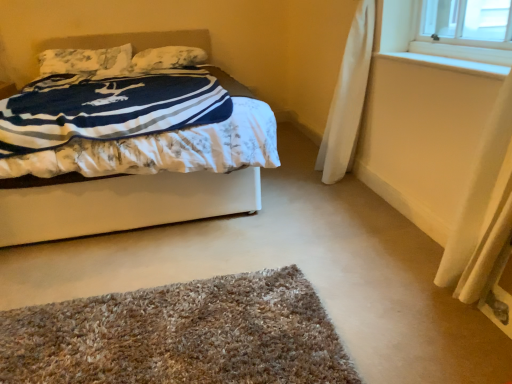
Question: Does brown shaggy rug at lower center lie in front of white fabric bed at center?

Choices:
 (A) no
 (B) yes

Answer: (B)

Question: From the image's perspective, is brown shaggy rug at lower center located beneath white fabric bed at center?

Choices:
 (A) no
 (B) yes

Answer: (B)

Question: From the image's perspective, would you say brown shaggy rug at lower center is positioned over white fabric bed at center?

Choices:
 (A) no
 (B) yes

Answer: (A)

Question: Can you confirm if brown shaggy rug at lower center is shorter than white fabric bed at center?

Choices:
 (A) no
 (B) yes

Answer: (B)

Question: Can you confirm if brown shaggy rug at lower center is taller than white fabric bed at center?

Choices:
 (A) yes
 (B) no

Answer: (B)

Question: Considering the positions of white fabric bed at center and brown shaggy rug at lower center in the image, is white fabric bed at center bigger or smaller than brown shaggy rug at lower center?

Choices:
 (A) small
 (B) big

Answer: (B)

Question: From a real-world perspective, is white fabric bed at center above or below brown shaggy rug at lower center?

Choices:
 (A) above
 (B) below

Answer: (A)

Question: In the image, is white fabric bed at center on the left side or the right side of brown shaggy rug at lower center?

Choices:
 (A) left
 (B) right

Answer: (A)

Question: Considering the positions of white fabric bed at center and brown shaggy rug at lower center in the image, is white fabric bed at center taller or shorter than brown shaggy rug at lower center?

Choices:
 (A) tall
 (B) short

Answer: (A)

Question: Considering the positions of fluffy white pillow at upper left, positioned as the 1th pillow in left-to-right order, and white soft pillow at upper center, which ranks as the 1th pillow in right-to-left order, in the image, is fluffy white pillow at upper left, positioned as the 1th pillow in left-to-right order, bigger or smaller than white soft pillow at upper center, which ranks as the 1th pillow in right-to-left order,?

Choices:
 (A) big
 (B) small

Answer: (A)

Question: Is fluffy white pillow at upper left, acting as the 2th pillow starting from the right, taller or shorter than white soft pillow at upper center, the second pillow positioned from the left?

Choices:
 (A) short
 (B) tall

Answer: (B)

Question: From a real-world perspective, is fluffy white pillow at upper left, positioned as the 1th pillow in left-to-right order, above or below white soft pillow at upper center, the second pillow positioned from the left?

Choices:
 (A) below
 (B) above

Answer: (B)

Question: Relative to white soft pillow at upper center, which ranks as the 1th pillow in right-to-left order, is fluffy white pillow at upper left, positioned as the 1th pillow in left-to-right order, in front or behind?

Choices:
 (A) behind
 (B) front

Answer: (B)

Question: Is white fabric bed at center wider or thinner than white soft pillow at upper center, which ranks as the 1th pillow in right-to-left order?

Choices:
 (A) wide
 (B) thin

Answer: (A)

Question: In terms of height, does white fabric bed at center look taller or shorter compared to white soft pillow at upper center, the second pillow positioned from the left?

Choices:
 (A) tall
 (B) short

Answer: (A)